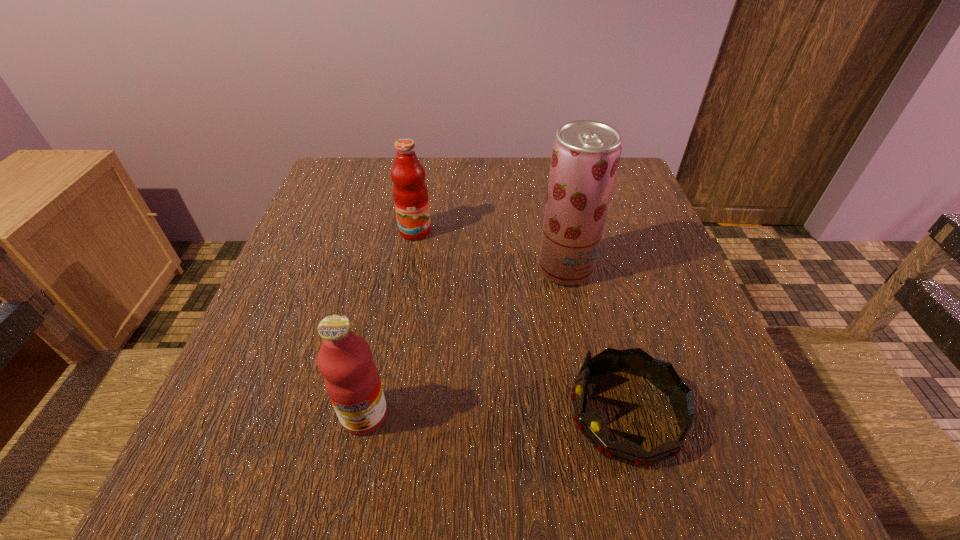
Find the location of `free spot between the nearest fruit juice and the shortest object`. free spot between the nearest fruit juice and the shortest object is located at coordinates (495, 414).

This screenshot has width=960, height=540. I want to click on free space between the farthest fruit juice and the tiara, so click(520, 323).

Locate an element on the screen. The image size is (960, 540). free space between the nearest fruit juice and the farthest fruit juice is located at coordinates (390, 323).

The height and width of the screenshot is (540, 960). I want to click on free space that is in between the nearest fruit juice and the tallest object, so click(x=465, y=342).

Locate an element on the screen. unoccupied position between the second nearest fruit juice and the tiara is located at coordinates (595, 341).

The width and height of the screenshot is (960, 540). What are the coordinates of `free spot between the shortest object and the rightmost fruit juice` in the screenshot? It's located at (595, 341).

Find the location of a particular element. The image size is (960, 540). unoccupied position between the nearest fruit juice and the tiara is located at coordinates (495, 414).

Locate an element on the screen. The height and width of the screenshot is (540, 960). blank region between the nearest fruit juice and the shortest object is located at coordinates (495, 414).

At what (x,y) coordinates should I click in order to perform the action: click on vacant area that lies between the nearest fruit juice and the second farthest object. Please return your answer as a coordinate pair (x, y). Looking at the image, I should click on (465, 342).

Locate an element on the screen. free space between the third nearest object and the farthest fruit juice is located at coordinates (491, 250).